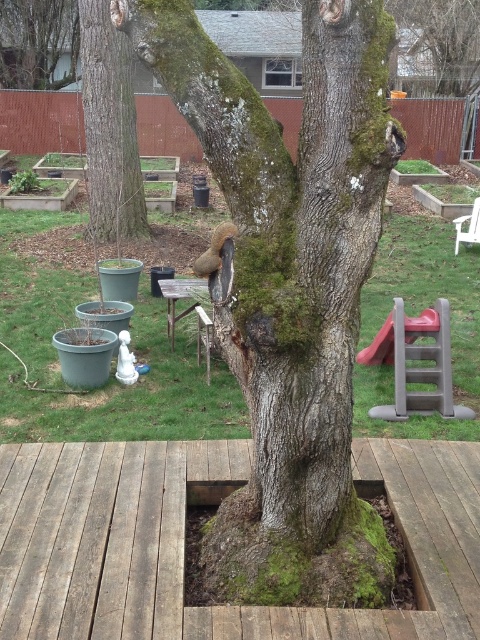
Question: Can you confirm if weathered wood deck at center is positioned above wooden picnic table at center?

Choices:
 (A) no
 (B) yes

Answer: (A)

Question: Which object is closer to the camera taking this photo?

Choices:
 (A) green mossy bark tree at center
 (B) green mossy tree trunk at upper left

Answer: (A)

Question: Does green mossy tree trunk at upper left appear under brown furry squirrel at center?

Choices:
 (A) yes
 (B) no

Answer: (B)

Question: Among these points, which one is farthest from the camera?

Choices:
 (A) (300, 593)
 (B) (220, 243)
 (C) (135, 212)

Answer: (C)

Question: Is weathered wood deck at center to the left of wooden picnic table at center from the viewer's perspective?

Choices:
 (A) yes
 (B) no

Answer: (B)

Question: Which of the following is the farthest from the observer?

Choices:
 (A) (143, 602)
 (B) (108, 177)
 (C) (369, 97)

Answer: (B)